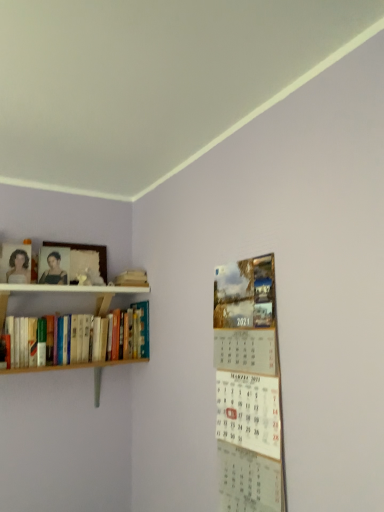
Question: From the image's perspective, is wooden photo frame at upper left under matte white portrait at left, acting as the 2th person starting from the right?

Choices:
 (A) no
 (B) yes

Answer: (B)

Question: Would you say wooden photo frame at upper left is a long distance from matte white portrait at left, acting as the 2th person starting from the right?

Choices:
 (A) yes
 (B) no

Answer: (B)

Question: Is wooden photo frame at upper left to the left of matte white portrait at left, the 1th person when ordered from left to right, from the viewer's perspective?

Choices:
 (A) yes
 (B) no

Answer: (B)

Question: From a real-world perspective, is wooden photo frame at upper left physically above matte white portrait at left, the 1th person when ordered from left to right?

Choices:
 (A) no
 (B) yes

Answer: (B)

Question: Would you say matte white portrait at left, the 1th person when ordered from left to right, is part of wooden photo frame at upper left's contents?

Choices:
 (A) no
 (B) yes

Answer: (A)

Question: Is the depth of wooden photo frame at upper left greater than that of matte white portrait at left, the 1th person when ordered from left to right?

Choices:
 (A) yes
 (B) no

Answer: (A)

Question: Is wooden books at left facing towards matte black portrait at upper left, which is counted as the first person, starting from the right?

Choices:
 (A) yes
 (B) no

Answer: (B)

Question: Does wooden books at left contain matte black portrait at upper left, the second person viewed from the left?

Choices:
 (A) no
 (B) yes

Answer: (A)

Question: Does wooden books at left have a lesser width compared to matte black portrait at upper left, which is counted as the first person, starting from the right?

Choices:
 (A) no
 (B) yes

Answer: (A)

Question: From a real-world perspective, is wooden books at left positioned under matte black portrait at upper left, the second person viewed from the left, based on gravity?

Choices:
 (A) yes
 (B) no

Answer: (A)

Question: Is wooden books at left further to the viewer compared to matte black portrait at upper left, the second person viewed from the left?

Choices:
 (A) yes
 (B) no

Answer: (B)

Question: Considering the relative sizes of wooden books at left and matte black portrait at upper left, the second person viewed from the left, in the image provided, is wooden books at left wider than matte black portrait at upper left, the second person viewed from the left,?

Choices:
 (A) yes
 (B) no

Answer: (A)

Question: From a real-world perspective, is matte black portrait at upper left, which is counted as the first person, starting from the right, under wooden photo frame at upper left?

Choices:
 (A) no
 (B) yes

Answer: (B)